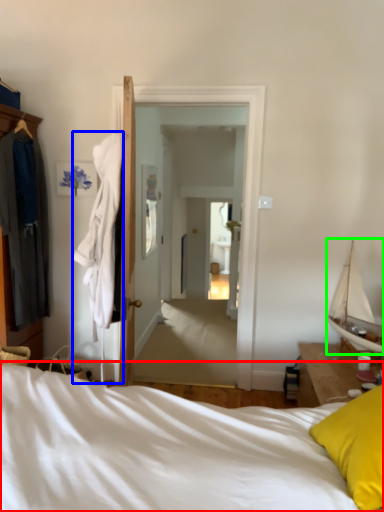
Question: Which object is positioned farthest from bed (highlighted by a red box)? Select from clothing (highlighted by a blue box) and boat (highlighted by a green box).

Choices:
 (A) clothing
 (B) boat

Answer: (B)